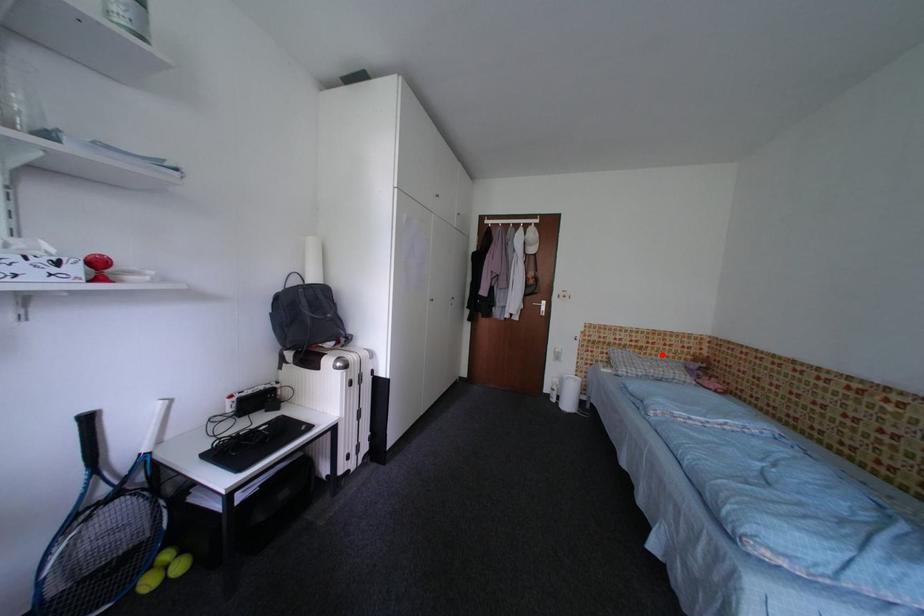
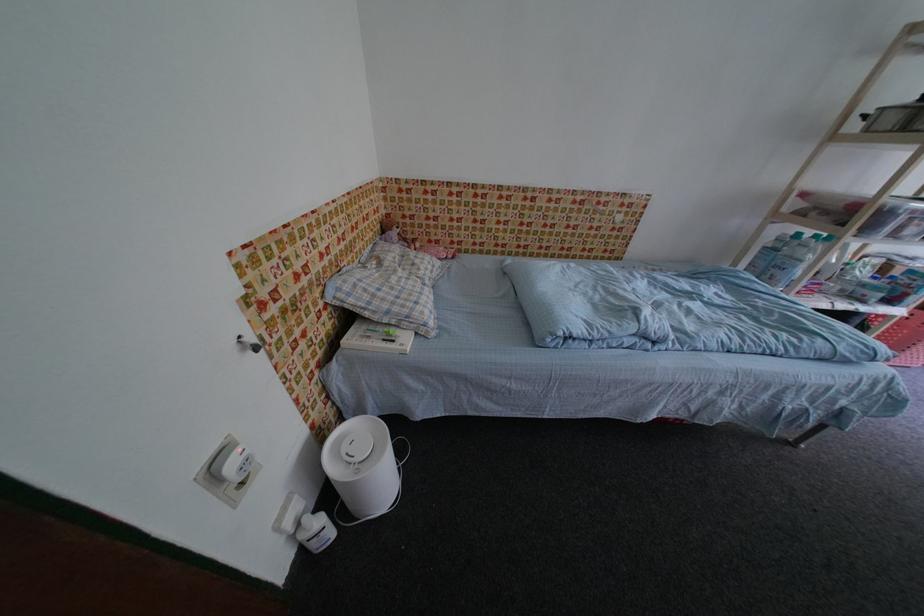
In the second image, find the point that corresponds to the highlighted location in the first image.

(370, 246)